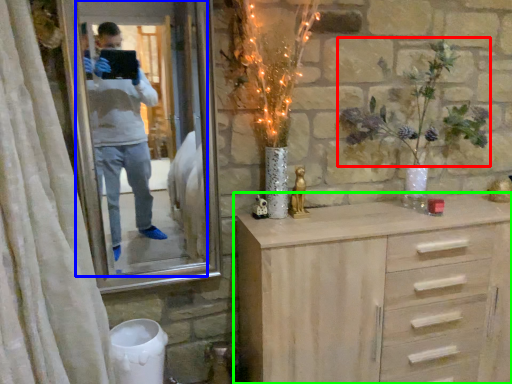
Question: Which object is the farthest from floral arrangement (highlighted by a red box)? Choose among these: mirror (highlighted by a blue box) or chest of drawers (highlighted by a green box).

Choices:
 (A) mirror
 (B) chest of drawers

Answer: (A)